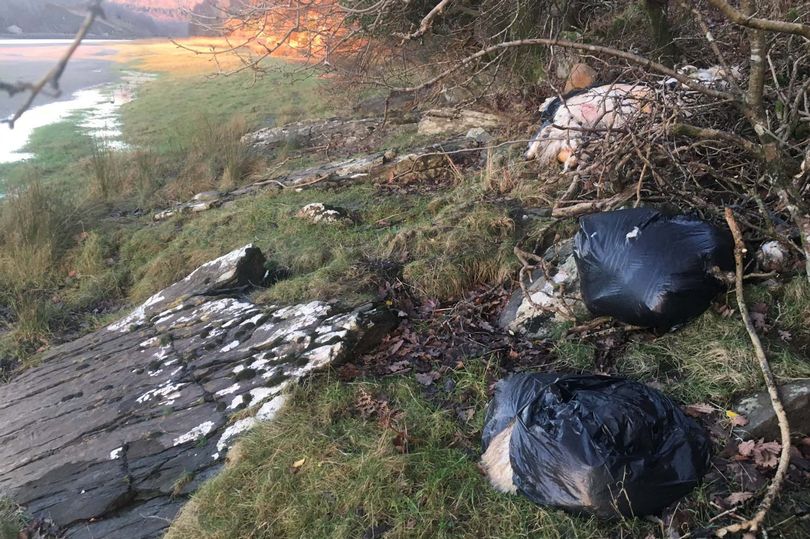
I want to click on trash, so click(492, 455), click(567, 265), click(787, 257), click(590, 109), click(559, 123), click(701, 73), click(526, 310), click(539, 297).